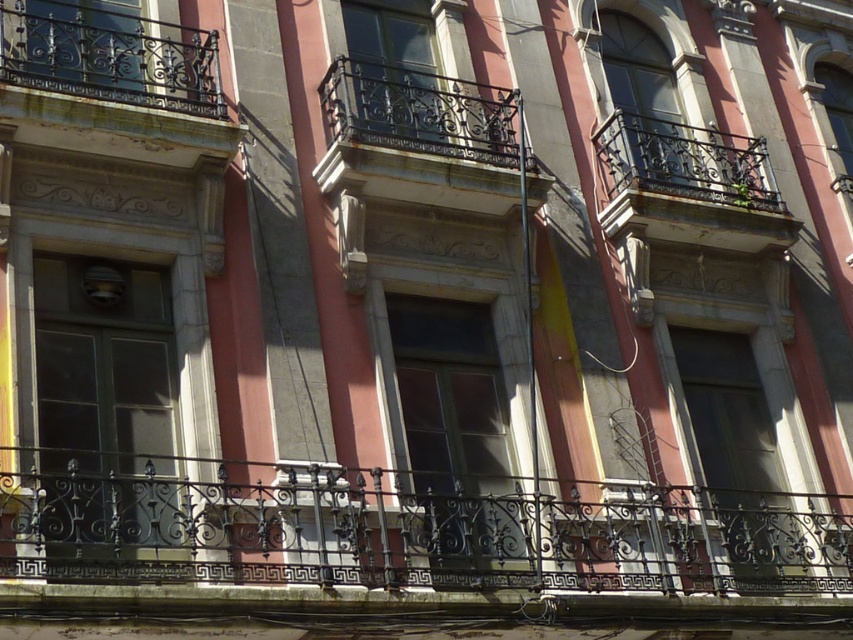
Question: Which object is positioned farthest from the rusty metal balcony at upper center?

Choices:
 (A) black wrought iron balcony at center
 (B) black wrought iron railing at center

Answer: (B)

Question: Which of the following is the closest to the observer?

Choices:
 (A) (505, 515)
 (B) (45, 52)

Answer: (B)

Question: In this image, where is rusty wrought iron balcony at upper left located relative to black wrought iron balcony at center?

Choices:
 (A) right
 (B) left

Answer: (B)

Question: Does black wrought iron railing at center have a greater width compared to rusty metal balcony at upper center?

Choices:
 (A) no
 (B) yes

Answer: (B)

Question: Is black wrought iron railing at center above black wrought iron balcony at center?

Choices:
 (A) no
 (B) yes

Answer: (A)

Question: Based on their relative distances, which object is nearer to the black wrought iron railing at center?

Choices:
 (A) rusty metal balcony at upper center
 (B) rusty wrought iron balcony at upper left

Answer: (A)